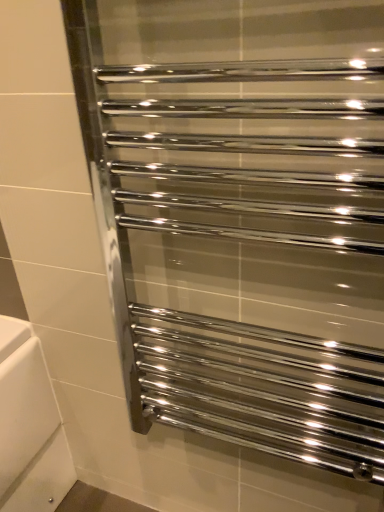
In order to face chrome/metallic towel rack at center, should I rotate leftwards or rightwards?

You should look right and rotate roughly 7.103 degrees.

The width and height of the screenshot is (384, 512). What do you see at coordinates (259, 254) in the screenshot?
I see `chrome/metallic towel rack at center` at bounding box center [259, 254].

This screenshot has height=512, width=384. I want to click on chrome/metallic towel rack at center, so click(259, 254).

What is the approximate width of chrome/metallic towel rack at center?

It is 4.81 inches.

Where is `chrome/metallic towel rack at center`? chrome/metallic towel rack at center is located at coordinates (259, 254).